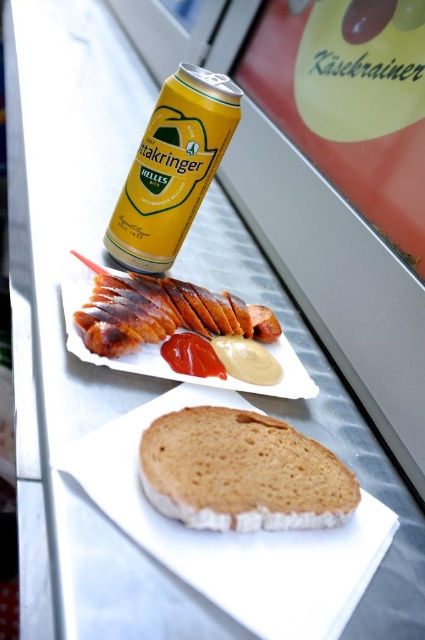
Question: Which point is farther to the camera?

Choices:
 (A) yellow matte can at upper center
 (B) smokey brown sausage at center
 (C) brown matte bread at center

Answer: (A)

Question: Which of the following is the farthest from the observer?

Choices:
 (A) smokey brown sausage at center
 (B) brown matte bread at center

Answer: (A)

Question: Which point is farther to the camera?

Choices:
 (A) yellow matte can at upper center
 (B) smokey brown sausage at center
 (C) brown matte bread at center

Answer: (A)

Question: Does brown matte bread at center appear under smokey brown sausage at center?

Choices:
 (A) yes
 (B) no

Answer: (A)

Question: Can you confirm if brown matte bread at center is positioned below smokey brown sausage at center?

Choices:
 (A) yes
 (B) no

Answer: (A)

Question: From the image, what is the correct spatial relationship of brown matte bread at center in relation to yellow matte can at upper center?

Choices:
 (A) left
 (B) right

Answer: (B)